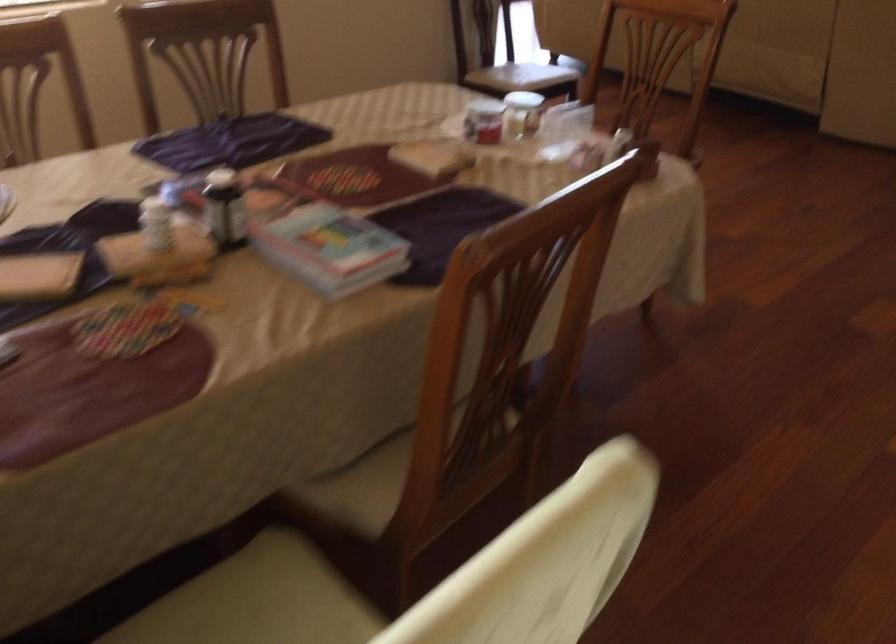
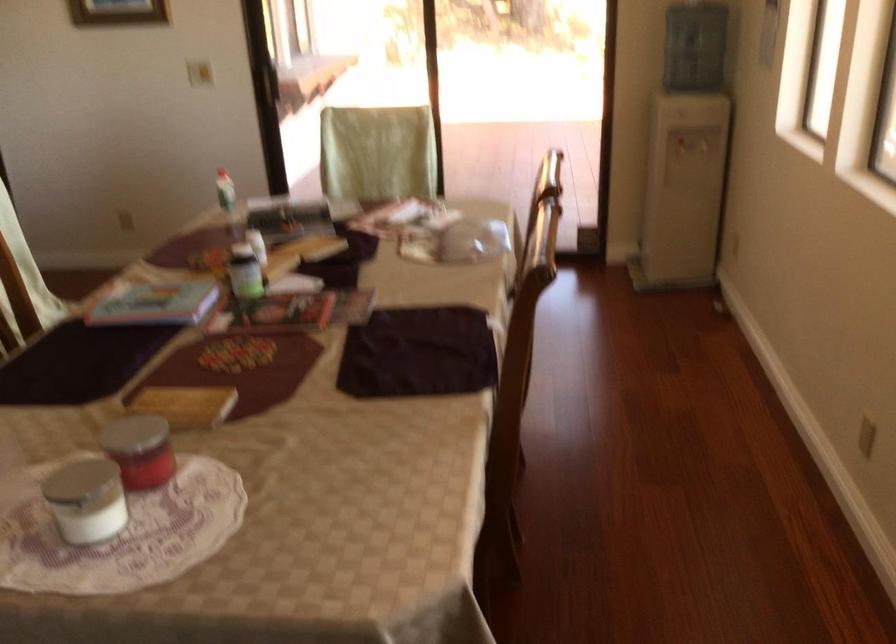
Find the pixel in the second image that matches the point at 476,122 in the first image.

(162, 465)